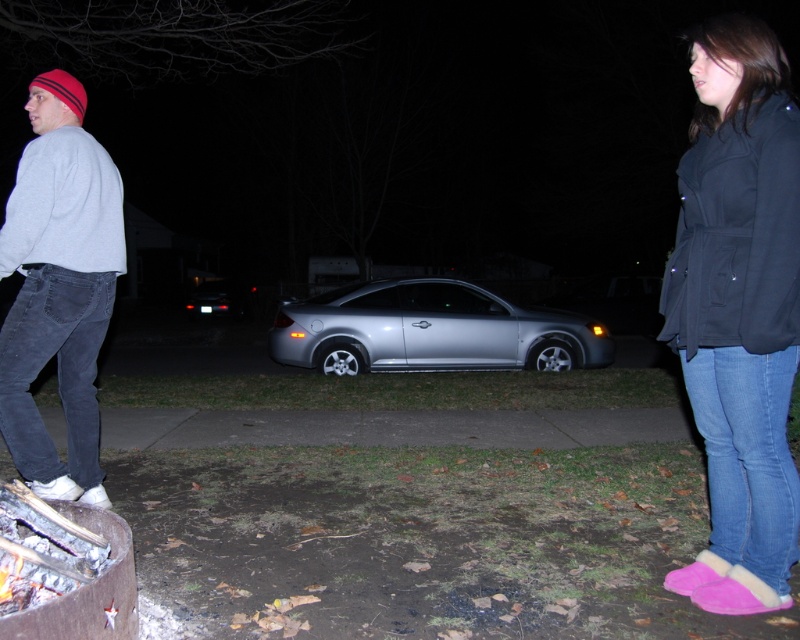
You are a photographer trying to capture the two people near the fire pit. To ensure both the gray cotton sweatshirt at left and the black matte jacket at right are clearly visible in your photo, which part of the frame should you focus on first?

You should focus on the gray cotton sweatshirt at left first because it is located below the black matte jacket at right, so adjusting focus starting from the lower area will help capture both subjects effectively.

Based on the photo, you are observing the nighttime scene from a distance. You notice two objects in the image, the gray cotton sweatshirt at left and the silver metallic car at center. Which object appears taller in the scene?

The gray cotton sweatshirt at left appears much taller than the silver metallic car at center in the scene.